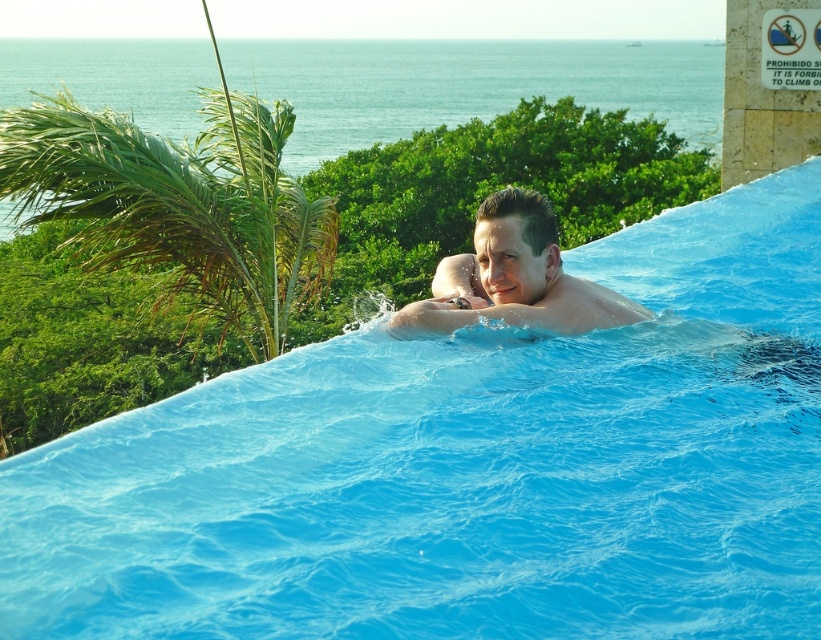
Is green leafy palm tree at upper left further to camera compared to smooth skin man at center?

Yes, green leafy palm tree at upper left is further from the viewer.

Can you confirm if green leafy palm tree at upper left is smaller than smooth skin man at center?

Incorrect, green leafy palm tree at upper left is not smaller in size than smooth skin man at center.

Between point (310, 202) and point (569, 298), which one is positioned behind?

Point (310, 202)

Identify the location of green leafy palm tree at upper left. The height and width of the screenshot is (640, 821). (179, 204).